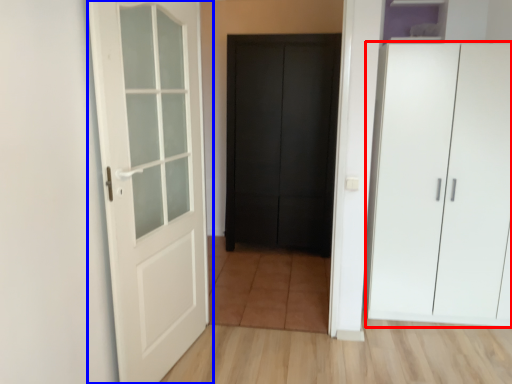
Question: Which of the following is the farthest to the observer, cupboard (highlighted by a red box) or door (highlighted by a blue box)?

Choices:
 (A) cupboard
 (B) door

Answer: (A)